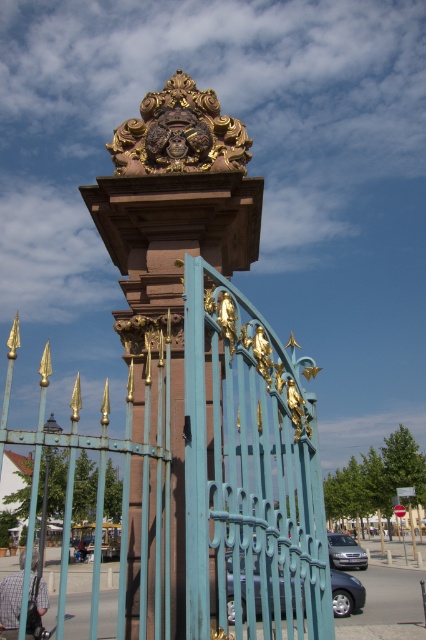
The image size is (426, 640). In order to click on polished bronze sculpture at center in this screenshot , I will do [173, 243].

Measure the distance between point [164,320] and camera.

They are 43.79 feet apart.

Between point (132, 218) and point (167, 93), which one is positioned in front?

Point (132, 218) is in front.

Locate an element on the screen. Image resolution: width=426 pixels, height=640 pixels. polished bronze sculpture at center is located at coordinates (173, 243).

Does teal painted metal gate at center have a smaller size compared to gold ornate sculpture at upper center?

Correct, teal painted metal gate at center occupies less space than gold ornate sculpture at upper center.

Is teal painted metal gate at center further to the viewer compared to gold ornate sculpture at upper center?

No, it is not.

Is point (290, 577) less distant than point (166, 131)?

Yes, it is.

The height and width of the screenshot is (640, 426). In order to click on teal painted metal gate at center in this screenshot , I will do `click(250, 472)`.

Does teal painted metal gate at center appear over polished bronze sculpture at center?

No.

Is teal painted metal gate at center smaller than polished bronze sculpture at center?

Yes, teal painted metal gate at center is smaller than polished bronze sculpture at center.

I want to click on teal painted metal gate at center, so click(x=250, y=472).